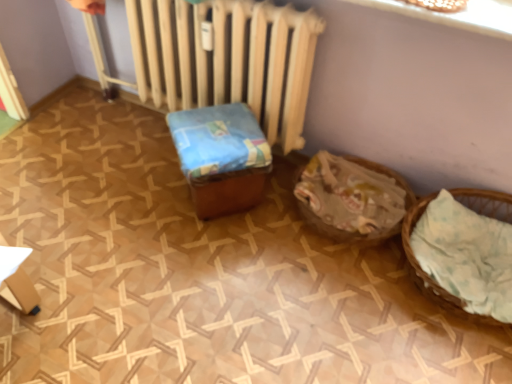
Find the location of a particular element. This screenshot has height=384, width=512. vacant space in front of blue fabric-covered box at center is located at coordinates (216, 256).